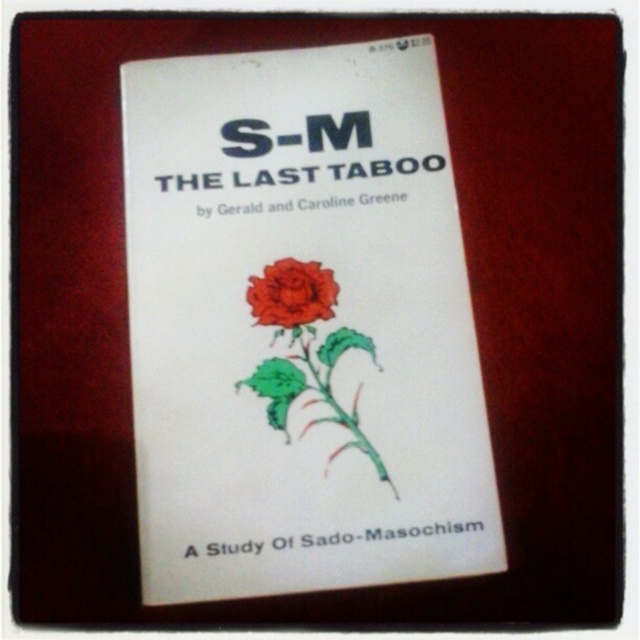
Does white paper book at center have a greater width compared to matte red rose at center?

Correct, the width of white paper book at center exceeds that of matte red rose at center.

I want to click on white paper book at center, so click(x=300, y=326).

Who is more forward, (426, 150) or (262, 296)?

Point (262, 296) is in front.

Identify the location of white paper book at center. (300, 326).